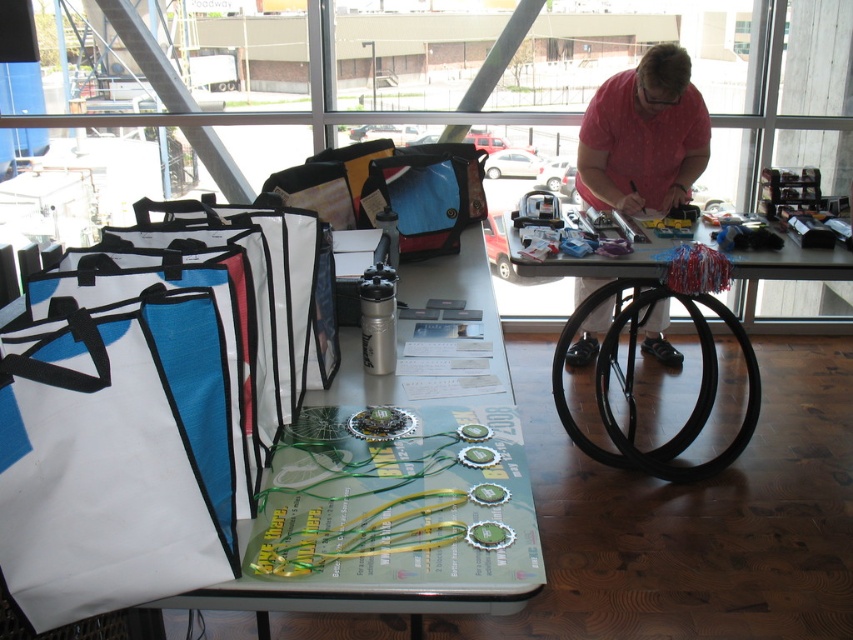
Question: Observing the image, what is the correct spatial positioning of white fabric bags at left in reference to matte blue fabric bag at center?

Choices:
 (A) above
 (B) below

Answer: (B)

Question: Does black rubber wheelchair at lower center appear over matte blue fabric bag at center?

Choices:
 (A) yes
 (B) no

Answer: (B)

Question: Does white non-woven tote at left appear on the left side of pink dotted shirt at upper right?

Choices:
 (A) no
 (B) yes

Answer: (B)

Question: Which object is the closest to the black rubber table at center?

Choices:
 (A) black rubber wheelchair at lower center
 (B) matte blue fabric bag at center
 (C) white non-woven tote at left

Answer: (A)

Question: Among these objects, which one is nearest to the camera?

Choices:
 (A) pink dotted shirt at upper right
 (B) black rubber wheelchair at lower center

Answer: (B)

Question: Considering the real-world distances, which object is closest to the matte blue fabric bag at center?

Choices:
 (A) black rubber wheelchair at lower center
 (B) white fabric bags at left

Answer: (B)